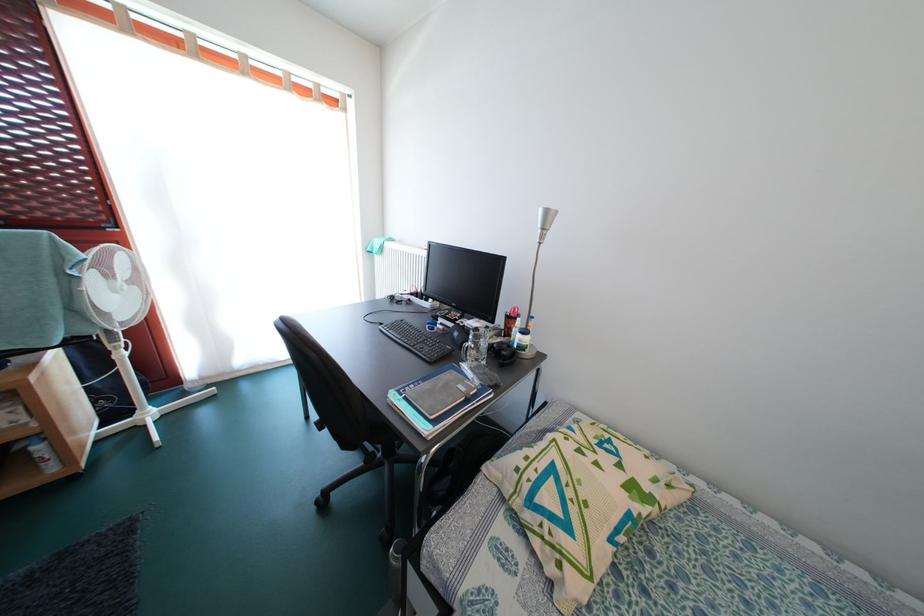
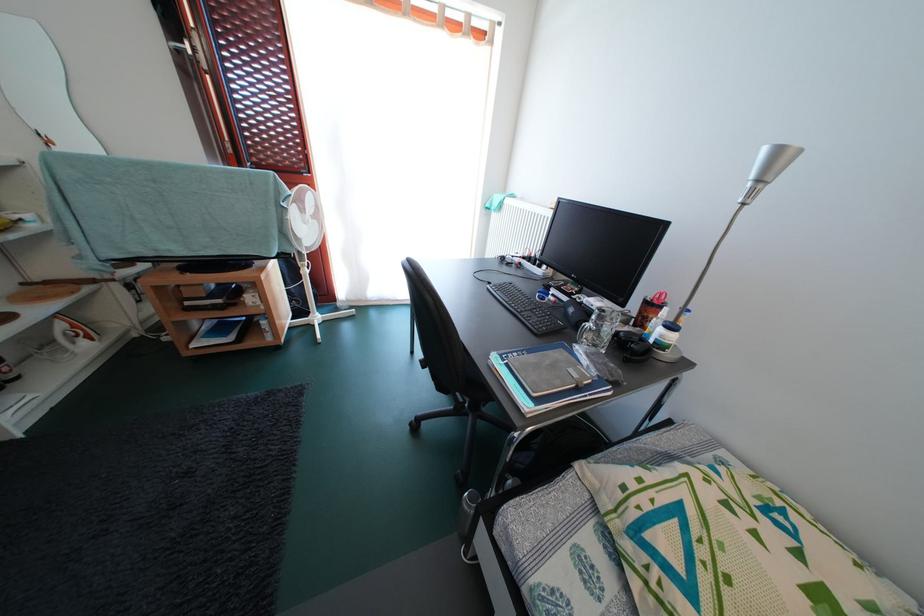
Find the pixel in the second image that matches the point at 407,246 in the first image.

(529, 204)